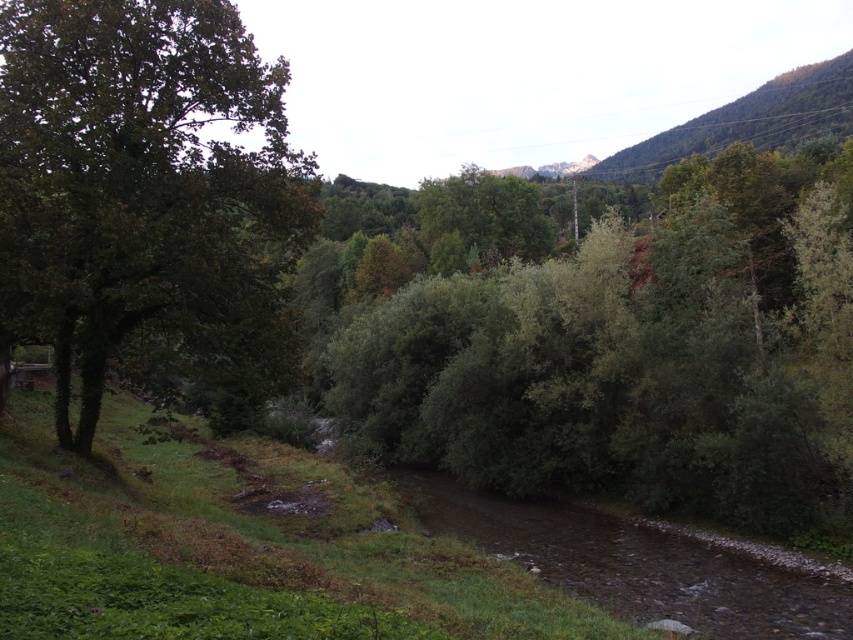
Question: Among these points, which one is nearest to the camera?

Choices:
 (A) (161, 136)
 (B) (404, 308)

Answer: (A)

Question: Is green leafy bush at center thinner than green leafy tree at left?

Choices:
 (A) no
 (B) yes

Answer: (B)

Question: Does green leafy bush at center have a greater width compared to green leafy tree at left?

Choices:
 (A) no
 (B) yes

Answer: (A)

Question: Where is green leafy bush at center located in relation to green leafy tree at left in the image?

Choices:
 (A) left
 (B) right

Answer: (B)

Question: Which point is farther to the camera?

Choices:
 (A) green leafy tree at left
 (B) green leafy bush at center

Answer: (B)